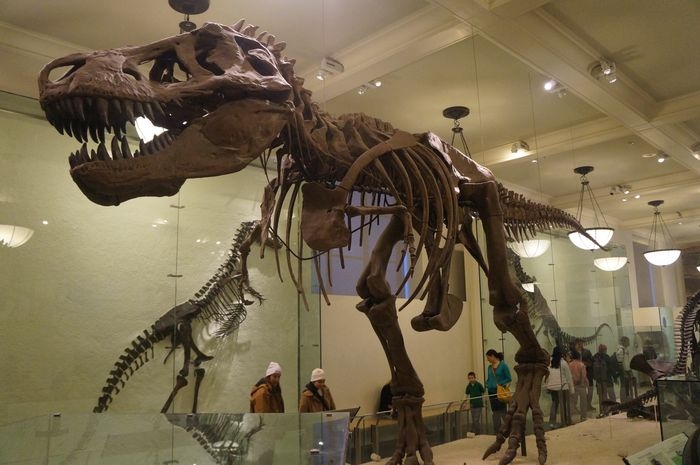
Locate an element on the screen. This screenshot has height=465, width=700. window is located at coordinates (341, 279).